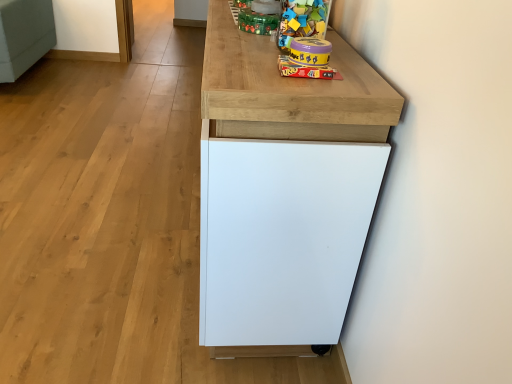
Question: Can you confirm if matte green plastic toy at upper center, arranged as the 1th toy when viewed from the back, is positioned to the right of matte yellow plastic uno game at upper center, placed as the 1th toy when sorted from bottom to top?

Choices:
 (A) no
 (B) yes

Answer: (A)

Question: Is matte green plastic toy at upper center, arranged as the 1th toy when viewed from the back, bigger than matte yellow plastic uno game at upper center, placed as the 1th toy when sorted from bottom to top?

Choices:
 (A) yes
 (B) no

Answer: (A)

Question: Is the position of matte green plastic toy at upper center, positioned as the 3th toy in front-to-back order, less distant than that of matte yellow plastic uno game at upper center, which appears as the 2th toy when viewed from the back?

Choices:
 (A) no
 (B) yes

Answer: (A)

Question: Is matte yellow plastic uno game at upper center, placed as the 1th toy when sorted from bottom to top, inside matte green plastic toy at upper center, arranged as the 1th toy when viewed from the back?

Choices:
 (A) yes
 (B) no

Answer: (B)

Question: Does matte green plastic toy at upper center, the 1th toy when ordered from top to bottom, have a smaller size compared to matte yellow plastic uno game at upper center, which is the 2th toy in front-to-back order?

Choices:
 (A) no
 (B) yes

Answer: (A)

Question: Does matte green plastic toy at upper center, the 1th toy when ordered from top to bottom, have a greater height compared to matte yellow plastic uno game at upper center, the third toy in the top-to-bottom sequence?

Choices:
 (A) yes
 (B) no

Answer: (A)

Question: Can you confirm if matte yellow plastic uno game at upper center, which appears as the 2th toy when viewed from the back, is shorter than white matte cabinet at center?

Choices:
 (A) no
 (B) yes

Answer: (B)

Question: Could white matte cabinet at center be considered to be inside matte yellow plastic uno game at upper center, placed as the 1th toy when sorted from bottom to top?

Choices:
 (A) yes
 (B) no

Answer: (B)

Question: Is matte yellow plastic uno game at upper center, which is the 2th toy in front-to-back order, taller than white matte cabinet at center?

Choices:
 (A) yes
 (B) no

Answer: (B)

Question: From the image's perspective, would you say matte yellow plastic uno game at upper center, placed as the 1th toy when sorted from bottom to top, is positioned over white matte cabinet at center?

Choices:
 (A) no
 (B) yes

Answer: (B)

Question: From a real-world perspective, is matte yellow plastic uno game at upper center, the third toy in the top-to-bottom sequence, physically above white matte cabinet at center?

Choices:
 (A) yes
 (B) no

Answer: (A)

Question: Is matte yellow plastic uno game at upper center, the third toy in the top-to-bottom sequence, positioned behind white matte cabinet at center?

Choices:
 (A) yes
 (B) no

Answer: (A)

Question: Considering the relative sizes of matte yellow plastic uno game at upper center, which is the 2th toy in front-to-back order, and matte green plastic toy at upper center, positioned as the 3th toy in front-to-back order, in the image provided, is matte yellow plastic uno game at upper center, which is the 2th toy in front-to-back order, thinner than matte green plastic toy at upper center, positioned as the 3th toy in front-to-back order,?

Choices:
 (A) no
 (B) yes

Answer: (B)